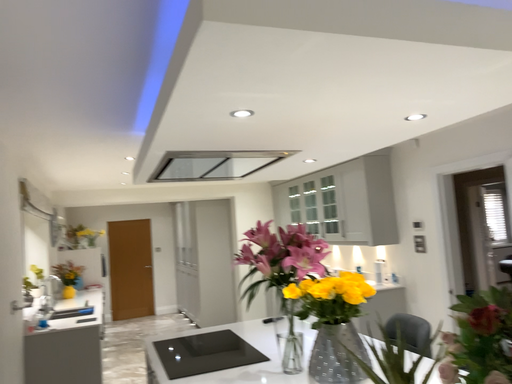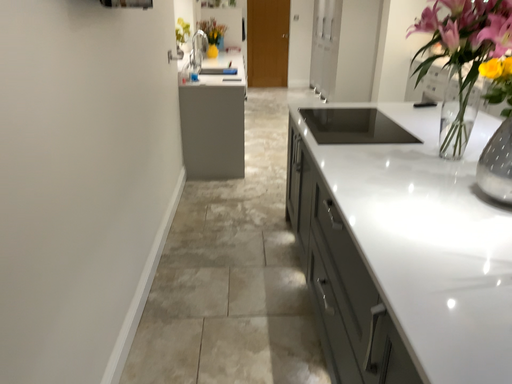
Question: Which way did the camera rotate in the video?

Choices:
 (A) rotated right
 (B) rotated left

Answer: (B)